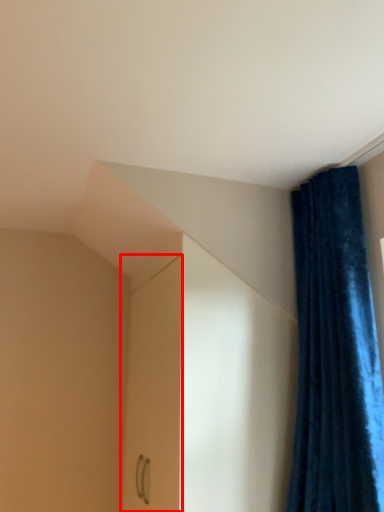
Question: From the image's perspective, where is screen door (annotated by the red box) located in relation to curtain in the image?

Choices:
 (A) below
 (B) above

Answer: (A)